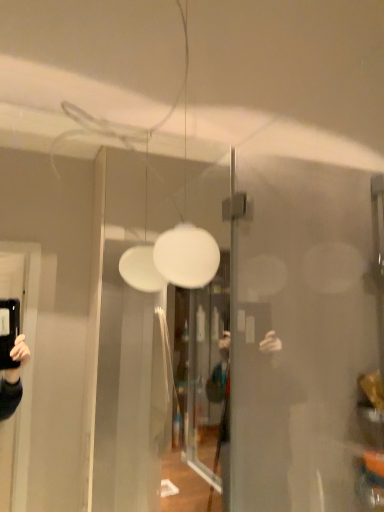
Question: Visually, is transparent glass door at center positioned to the left or to the right of white matte sphere at center?

Choices:
 (A) right
 (B) left

Answer: (B)

Question: Is transparent glass door at center in front of or behind white matte sphere at center in the image?

Choices:
 (A) front
 (B) behind

Answer: (A)

Question: From the image's perspective, is transparent glass door at center above or below white matte sphere at center?

Choices:
 (A) above
 (B) below

Answer: (B)

Question: In terms of size, does white matte sphere at center appear bigger or smaller than transparent glass door at center?

Choices:
 (A) big
 (B) small

Answer: (B)

Question: In terms of height, does white matte sphere at center look taller or shorter compared to transparent glass door at center?

Choices:
 (A) short
 (B) tall

Answer: (A)

Question: From the image's perspective, is white matte sphere at center located above or below transparent glass door at center?

Choices:
 (A) above
 (B) below

Answer: (A)

Question: Relative to transparent glass door at center, is white matte sphere at center in front or behind?

Choices:
 (A) behind
 (B) front

Answer: (A)